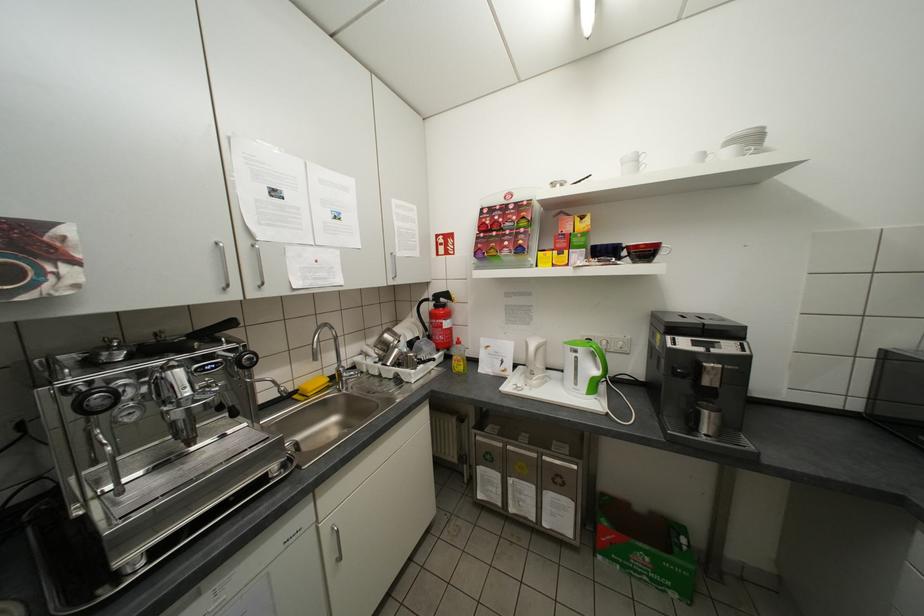
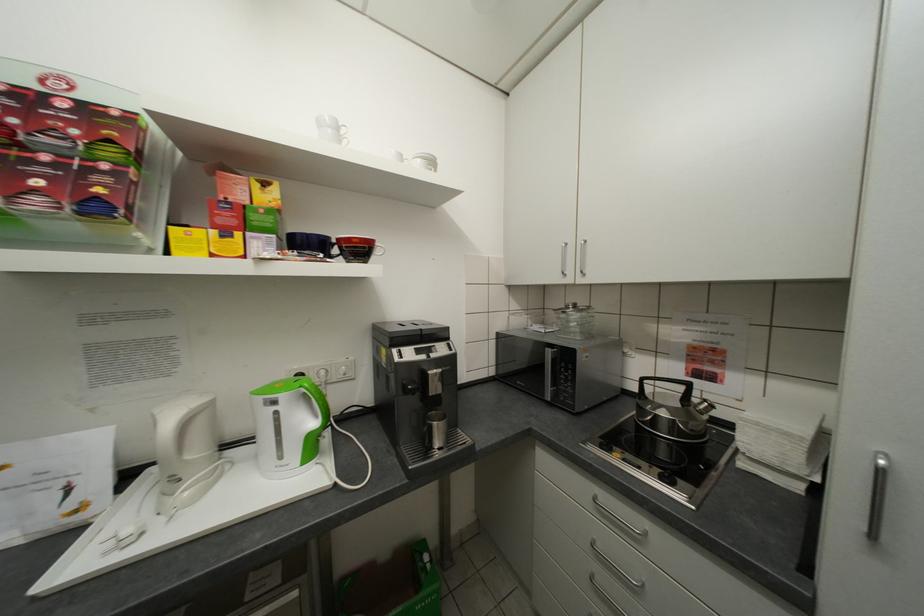
Question: Based on the continuous images, in which direction is the camera rotating? Reply with the corresponding letter.

Choices:
 (A) Left
 (B) Right
 (C) Up
 (D) Down

Answer: (B)